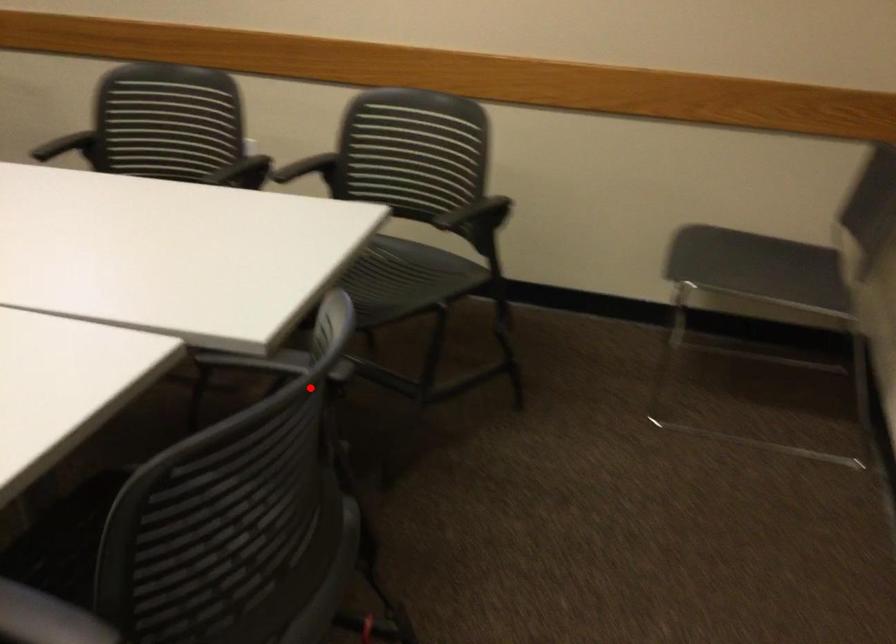
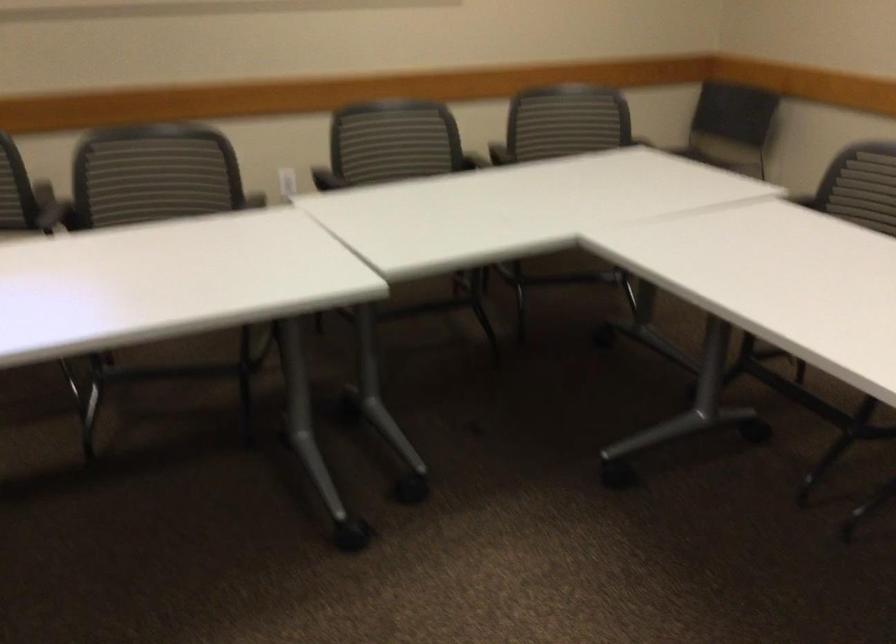
Find the pixel in the second image that matches the highlighted location in the first image.

(866, 185)